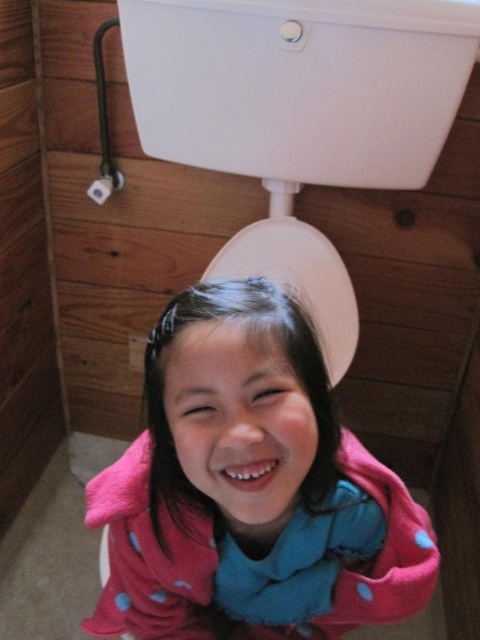
You are a bathroom designer and need to place a new decorative item between the pink polka dot towel at lower center and the white glossy toilet lid at center. Based on their positions, which side of the toilet lid should you place it to ensure it is between them?

The pink polka dot towel at lower center is to the left of the white glossy toilet lid at center, so placing the decorative item to the left side of the toilet lid would position it between them.

You are a bathroom designer and need to ensure that the white glossy toilet tank at upper center and the white glossy toilet lid at center are proportionate. Which object has a greater width?

The white glossy toilet tank at upper center has a greater width than the white glossy toilet lid at center.

You are a home inspector checking the bathroom. You need to determine which object is larger between the white glossy toilet tank at upper center and the white glossy toilet lid at center. Which one is bigger?

The white glossy toilet tank at upper center is bigger than the white glossy toilet lid at center according to the description.